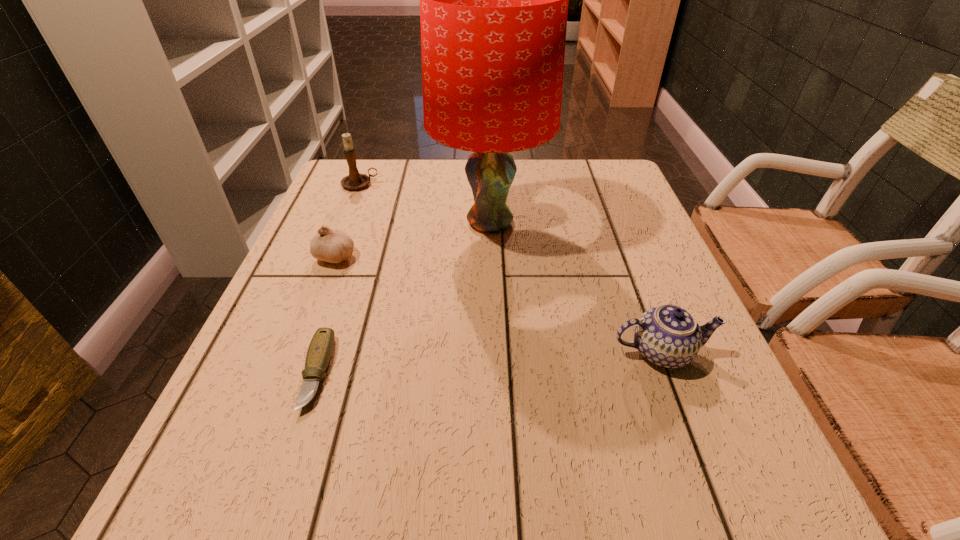
I want to click on lampshade, so click(x=493, y=0).

Find the location of `the second object from right to left`. the second object from right to left is located at coordinates 493,0.

At what (x,y) coordinates should I click in order to perform the action: click on candle holder. Please return your answer as a coordinate pair (x, y). The height and width of the screenshot is (540, 960). Looking at the image, I should click on (354, 181).

At what (x,y) coordinates should I click in order to perform the action: click on chinaware. Please return your answer as a coordinate pair (x, y). The height and width of the screenshot is (540, 960). Looking at the image, I should click on (668, 336).

This screenshot has height=540, width=960. I want to click on the rightmost object, so click(x=668, y=336).

What are the coordinates of `the second shortest object` in the screenshot? It's located at (334, 246).

Image resolution: width=960 pixels, height=540 pixels. In order to click on the shortest object in this screenshot , I will do `click(319, 353)`.

At what (x,y) coordinates should I click in order to perform the action: click on vacant space located 0.130m on the front-facing side of the lampshade. Please return your answer as a coordinate pair (x, y). The width and height of the screenshot is (960, 540). Looking at the image, I should click on (492, 301).

Find the location of a particular element. free space located on the side of the fourth shortest object with the handle is located at coordinates (504, 185).

Locate an element on the screen. vacant area located at the spout of the third shortest object is located at coordinates (702, 459).